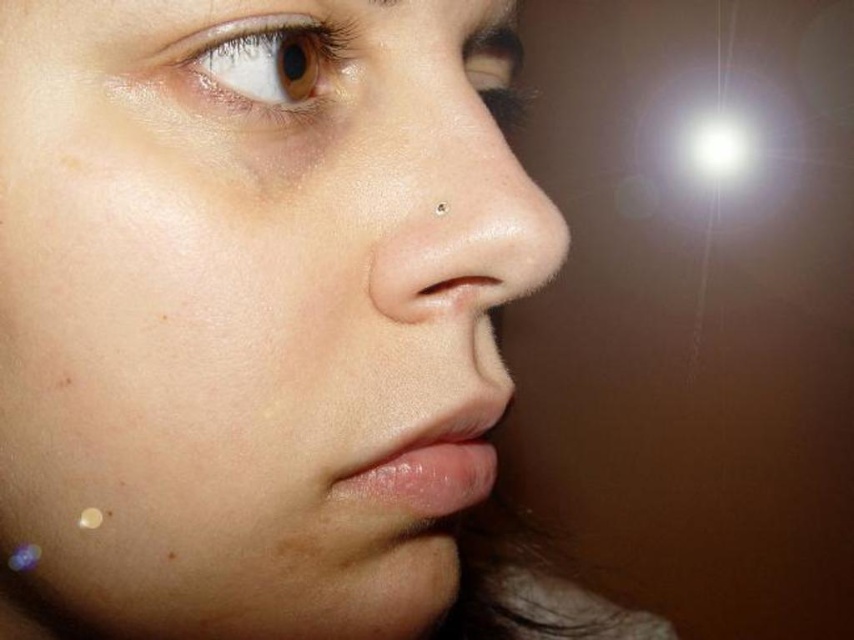
How distant is brown matte eye at upper left from brown matte freckle at lower center?

The distance of brown matte eye at upper left from brown matte freckle at lower center is 4.76 inches.

Who is more forward, (313, 96) or (167, 547)?

Positioned in front is point (167, 547).

Image resolution: width=854 pixels, height=640 pixels. Identify the location of brown matte eye at upper left. (262, 64).

Between point (240, 547) and point (203, 51), which one is positioned behind?

The point (240, 547) is behind.

Can you confirm if smooth skin face at center is positioned to the left of brown matte eye at upper left?

In fact, smooth skin face at center is to the right of brown matte eye at upper left.

Does point (492, 42) lie behind point (219, 76)?

Yes, point (492, 42) is behind point (219, 76).

Find the location of `smooth skin face at center`. smooth skin face at center is located at coordinates (255, 305).

In the scene shown: Does smooth skin nose at center appear under brown matte eye at upper left?

Yes, smooth skin nose at center is below brown matte eye at upper left.

Can you confirm if smooth skin nose at center is bigger than brown matte eye at upper left?

Correct, smooth skin nose at center is larger in size than brown matte eye at upper left.

Identify the location of smooth skin nose at center. (461, 209).